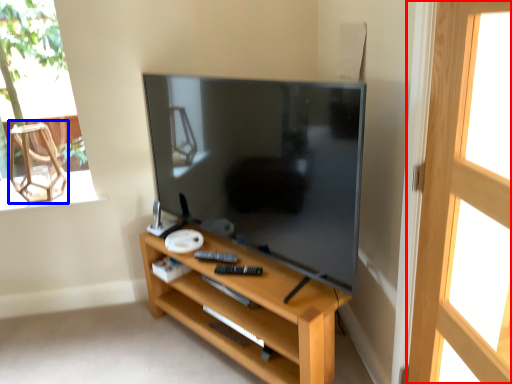
Question: Which point is further to the camera, screen door (highlighted by a red box) or armchair (highlighted by a blue box)?

Choices:
 (A) screen door
 (B) armchair

Answer: (B)